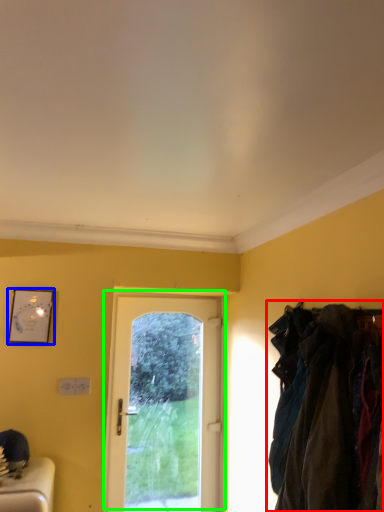
Question: Based on their relative distances, which object is nearer to laundry (highlighted by a red box)? Choose from picture frame (highlighted by a blue box) and door (highlighted by a green box).

Choices:
 (A) picture frame
 (B) door

Answer: (B)